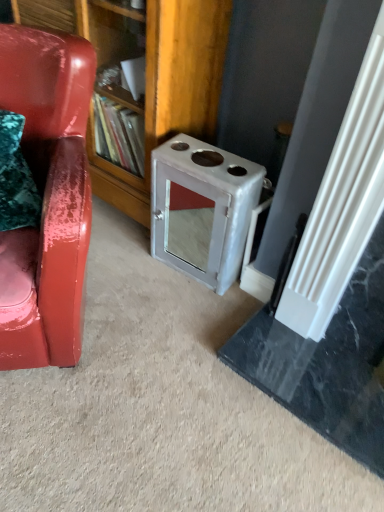
Locate an element on the screen. The width and height of the screenshot is (384, 512). free space underneath metallic gray stove at center-right (from a real-world perspective) is located at coordinates (180, 261).